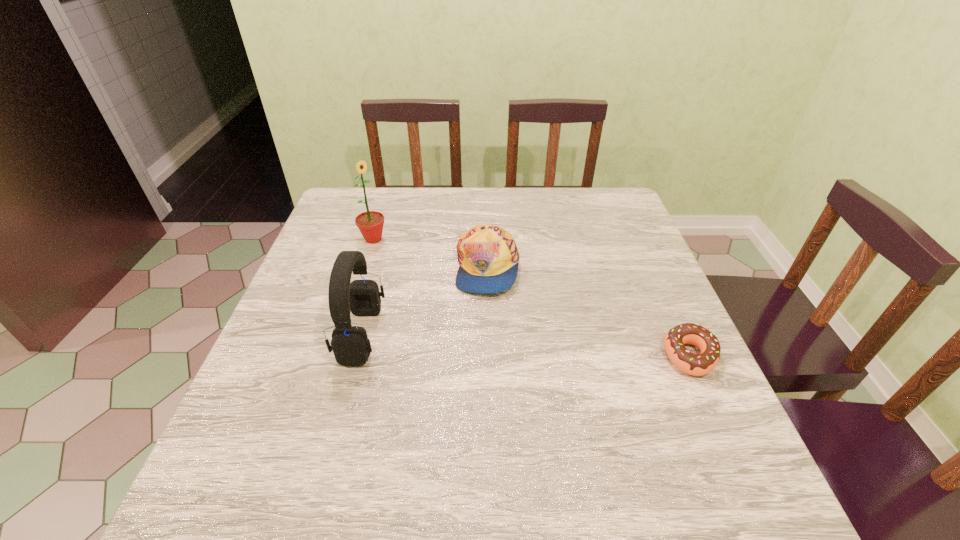
Identify the location of free space on the desktop that is between the headset and the doughnut and is positioned on the face of the tallest object. The width and height of the screenshot is (960, 540). (481, 342).

Identify the location of free spot on the desktop that is between the third shortest object and the doughnut and is positioned on the bill of the cap. (542, 347).